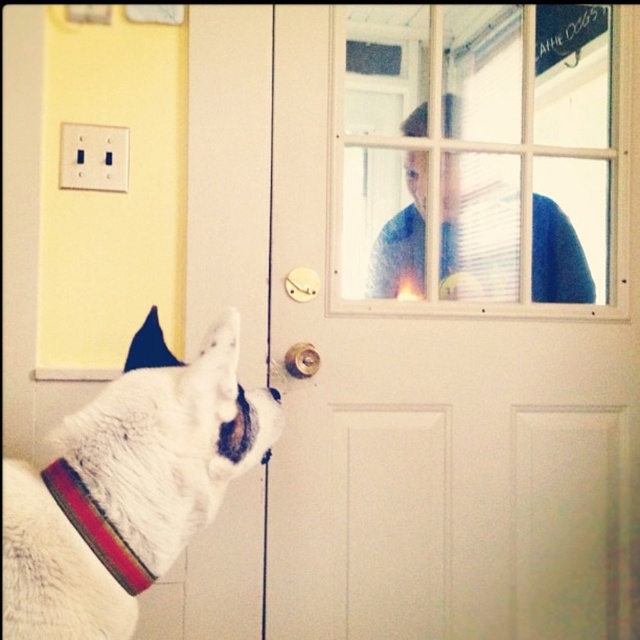
You are a delivery person trying to enter the house. You see the white matte screen door at center and the clear glass window at upper center. Which object should you interact with to gain access?

The white matte screen door at center is to the left of clear glass window at upper center, so you should interact with the white matte screen door at center to gain access.

You are a delivery person holding a package that is 28 inches long. You need to pass through the space between the clear glass window at upper center and the white fur collar at lower left. Can you fit through that space with the package?

The distance between the clear glass window at upper center and the white fur collar at lower left is 26.52 inches. Since the package is 28 inches long, it is slightly longer than the available space. You may need to reposition the package or find an alternative route to ensure it fits through the space.

You are standing in front of the glass door where the white dog with a red collar is looking out. You want to reach a point that is exactly 1.51 meters away from you. Can you reach the point at coordinates point (506, 12)?

The point at coordinates point (506, 12) is exactly 1.51 meters away from the viewer, so yes, you can reach it.